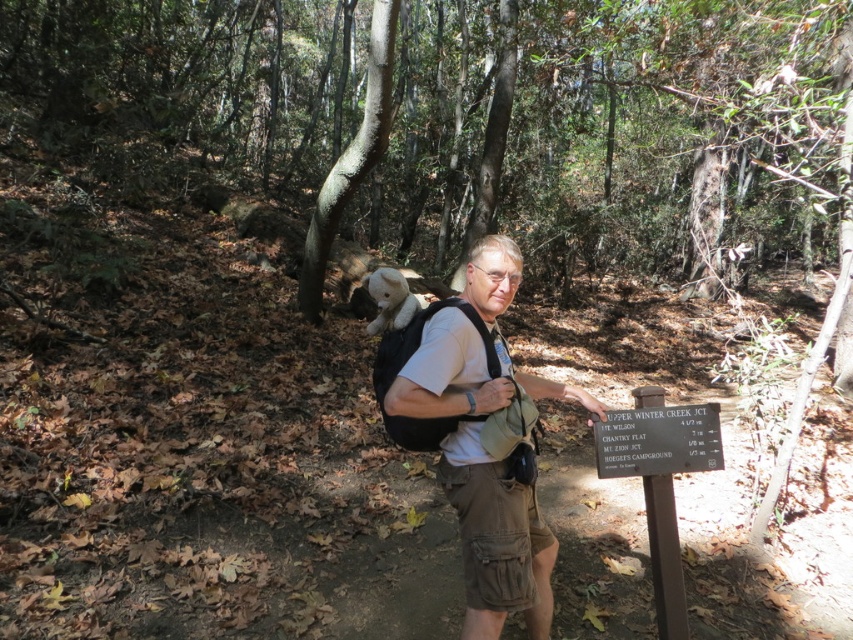
Question: Is matte black backpack at center wider than black plastic sign at center?

Choices:
 (A) no
 (B) yes

Answer: (B)

Question: Among these objects, which one is nearest to the camera?

Choices:
 (A) black plastic sign at center
 (B) matte black backpack at center

Answer: (B)

Question: Can you confirm if matte black backpack at center is thinner than black plastic sign at center?

Choices:
 (A) yes
 (B) no

Answer: (B)

Question: Observing the image, what is the correct spatial positioning of matte black backpack at center in reference to black plastic sign at center?

Choices:
 (A) above
 (B) below

Answer: (B)

Question: Which point appears closest to the camera in this image?

Choices:
 (A) (405, 422)
 (B) (607, 440)

Answer: (A)